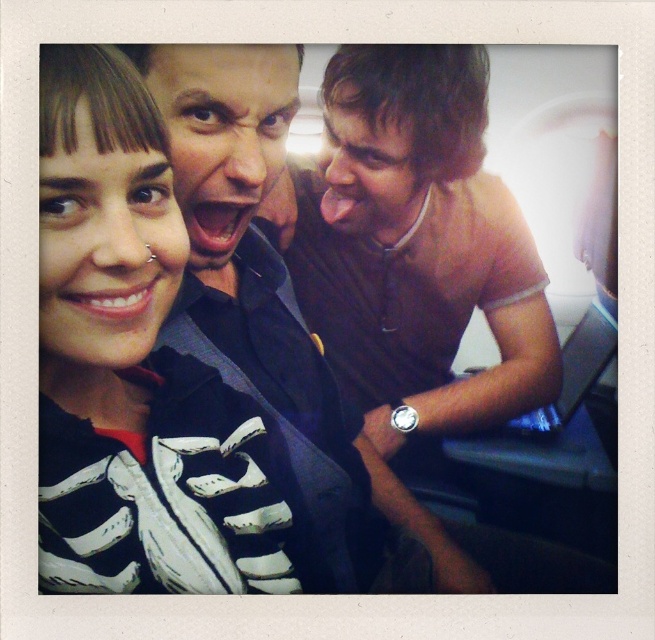
You are sitting in the airplane cabin and want to know which of the two points, point (162, 416) or point (436, 310), is closer to you. Based on the scene description, can you determine which point is nearer?

Point (162, 416) is in front of point (436, 310), so it is closer to you.

You are a photographer trying to capture a group photo of the matte black skeleton shirt at upper left and the brown fabric shirt at right. Since you want to ensure both shirts are clearly visible, which shirt should you adjust to be higher in the frame?

The matte black skeleton shirt at upper left has a lesser height compared to brown fabric shirt at right. To ensure both shirts are clearly visible, you should adjust the matte black skeleton shirt at upper left to be higher in the frame so it aligns with the height of the brown fabric shirt at right.

You are a photographer trying to capture a candid shot of the matte black skeleton shirt at upper left and the brown fabric shirt at right. Since the camera has a limited depth of field, you need to know which shirt is closer to the lens. Based on the scene, which shirt should you focus on to ensure it appears sharp?

The matte black skeleton shirt at upper left is positioned under the brown fabric shirt at right, so focusing on the brown fabric shirt at right would ensure it stays sharp as it is closer to the lens.